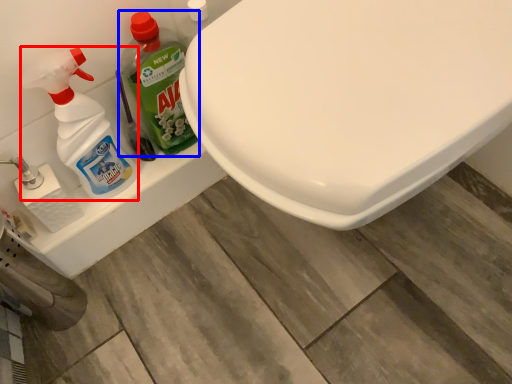
Question: Among these objects, which one is nearest to the camera, cleaning product (highlighted by a red box) or cleaning product (highlighted by a blue box)?

Choices:
 (A) cleaning product
 (B) cleaning product

Answer: (A)